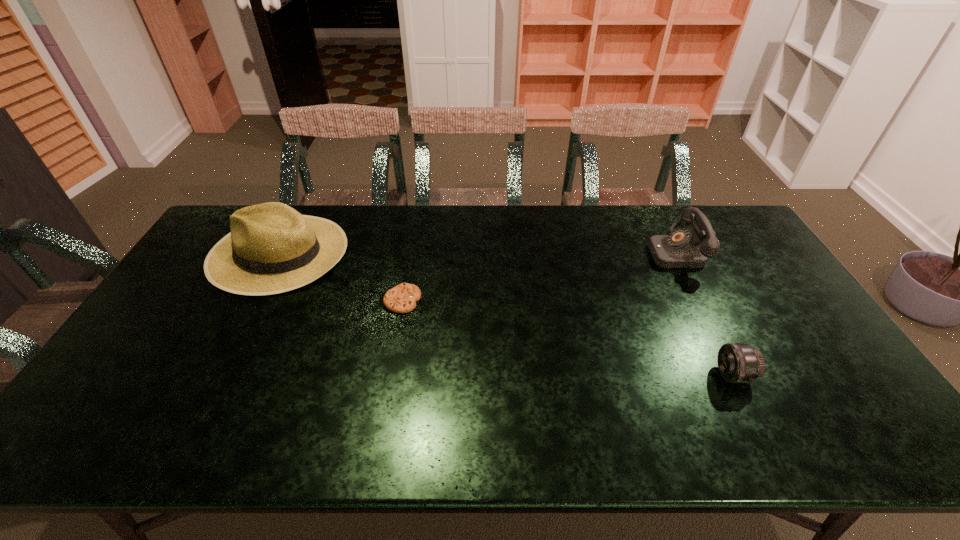
The width and height of the screenshot is (960, 540). I want to click on free space at the left edge of the desktop, so point(179,311).

You are a GUI agent. You are given a task and a screenshot of the screen. Output one action in this format:
    pyautogui.click(x=<x>, y=<y>)
    Task: Click on the free space at the right edge
    This screenshot has height=540, width=960.
    Given the screenshot: What is the action you would take?
    pyautogui.click(x=773, y=309)

The image size is (960, 540). In the image, there is a desktop. What are the coordinates of `vacant space at the far right corner` in the screenshot? It's located at (719, 228).

Image resolution: width=960 pixels, height=540 pixels. What are the coordinates of `vacant area between the telephone and the sunhat` in the screenshot? It's located at (476, 252).

Where is `free spot between the telephone and the sunhat`? free spot between the telephone and the sunhat is located at coordinates (476, 252).

Where is `blank region between the sunhat and the shortest object`? blank region between the sunhat and the shortest object is located at coordinates (341, 276).

This screenshot has width=960, height=540. Identify the location of free space between the cookie and the telephone. (539, 276).

What are the coordinates of `free space between the telephoto lens and the third object from right to left` in the screenshot? It's located at [567, 338].

Find the location of a particular element. free space between the sunhat and the telephone is located at coordinates (476, 252).

In order to click on blank region between the sunhat and the telephone in this screenshot , I will do `click(476, 252)`.